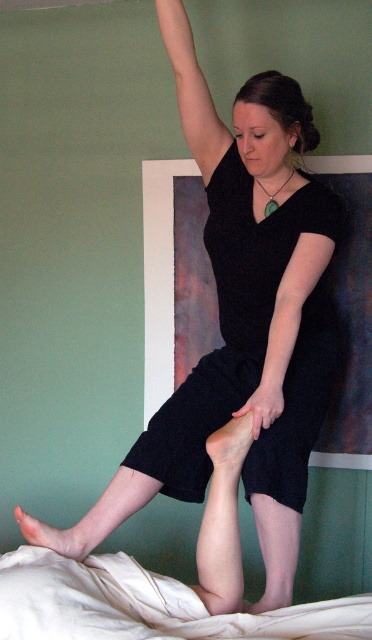
Question: Which point is farther from the camera taking this photo?

Choices:
 (A) (79, 541)
 (B) (287, 413)
 (C) (277, 291)
 (D) (107, 566)

Answer: (C)

Question: Which object is positioned farthest from the smooth skin arm at upper center?

Choices:
 (A) black textured dress at center
 (B) pale skin/soft flesh at lower left
 (C) black matte arm at center

Answer: (B)

Question: From the image, what is the correct spatial relationship of white fabric bed at lower left in relation to smooth skin arm at upper center?

Choices:
 (A) above
 (B) below

Answer: (B)

Question: Does white fabric bed at lower left have a lesser width compared to matte white foot at lower center?

Choices:
 (A) no
 (B) yes

Answer: (A)

Question: Which object appears farthest from the camera in this image?

Choices:
 (A) smooth skin arm at upper center
 (B) pale skin/soft flesh at lower left
 (C) black textured dress at center
 (D) matte white foot at lower center

Answer: (A)

Question: Is black matte arm at center thinner than pale skin/soft flesh at lower left?

Choices:
 (A) no
 (B) yes

Answer: (A)